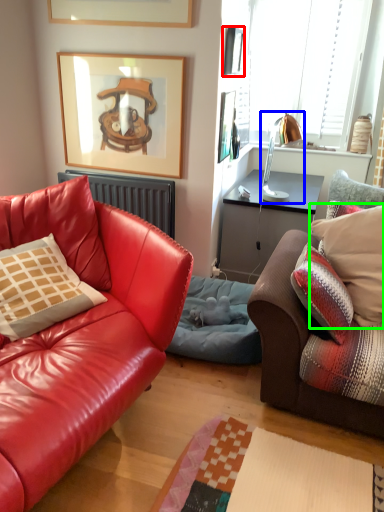
Question: Estimate the real-world distances between objects in this image. Which object is closer to picture frame (highlighted by a red box), lamp (highlighted by a blue box) or pillow (highlighted by a green box)?

Choices:
 (A) lamp
 (B) pillow

Answer: (A)